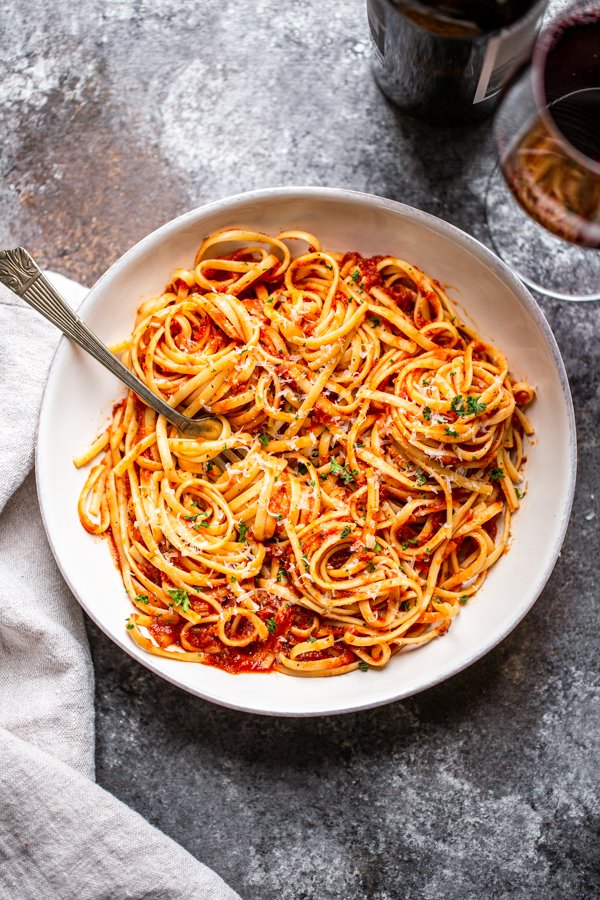
You are a GUI agent. You are given a task and a screenshot of the screen. Output one action in this format:
    pyautogui.click(x=<x>, y=<y>)
    Task: Click on the base of glass
    This screenshot has width=600, height=900.
    Given the screenshot: What is the action you would take?
    pyautogui.click(x=544, y=256)